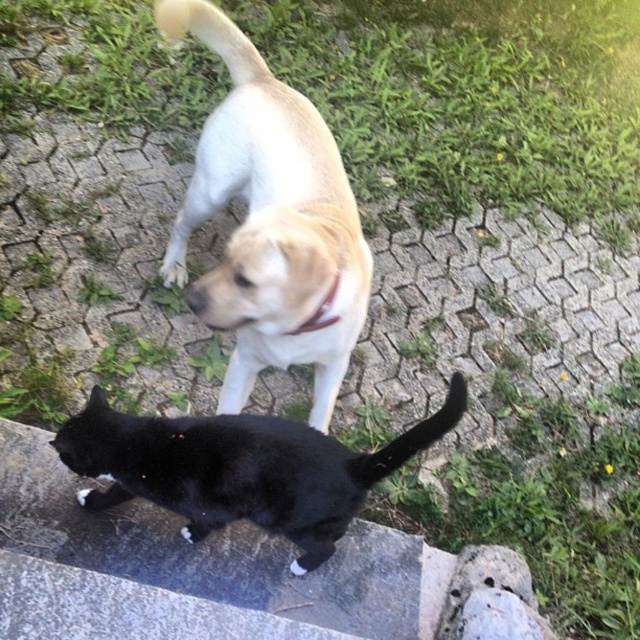
You are a photographer trying to capture both the light brown fur dog at center and the black matte fur cat at lower left in the same frame. Based on their sizes, which animal would appear smaller in the photo?

The light brown fur dog at center would appear smaller in the photo since it has a lesser width compared to the black matte fur cat at lower left.

You are a photographer trying to capture a photo of the black matte fur cat at lower left and the black matte tail at lower center. Since you want to ensure both subjects are in frame, can you determine which direction the cat is facing?

The black matte fur cat at lower left is to the left of the black matte tail at lower center, so the cat is facing away from the photographer towards the right side.

You are a photographer trying to capture a photo of both the light brown fur dog at center and the black matte fur cat at lower left. Given that your camera has a 100mm lens with a depth of field that can focus on objects within a 15 inch range, will both animals be in focus in the same shot?

The light brown fur dog at center and the black matte fur cat at lower left are 16.54 inches apart. Since the depth of field can only focus on objects within a 15 inch range, the distance between them exceeds this limit. Therefore, both animals cannot be in focus simultaneously in the same shot.